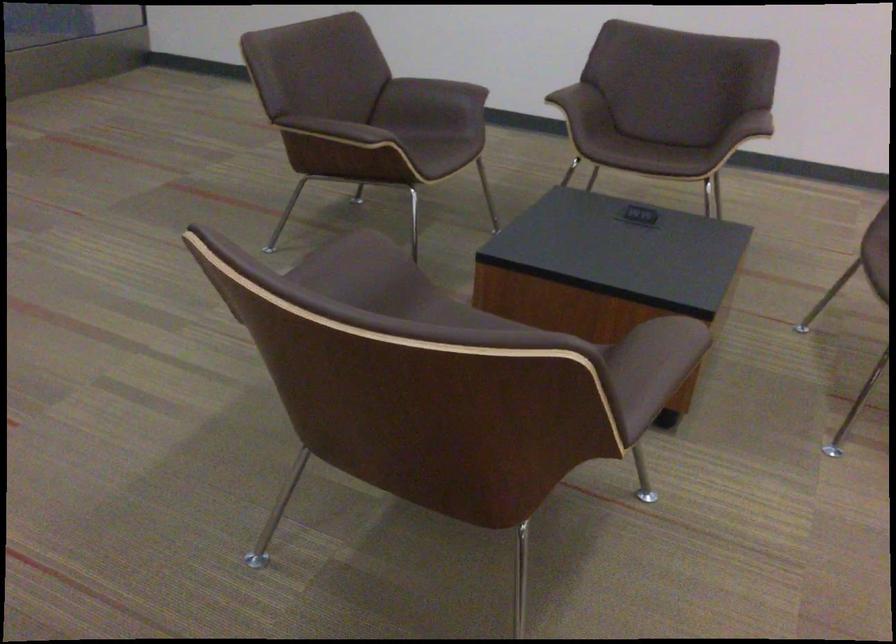
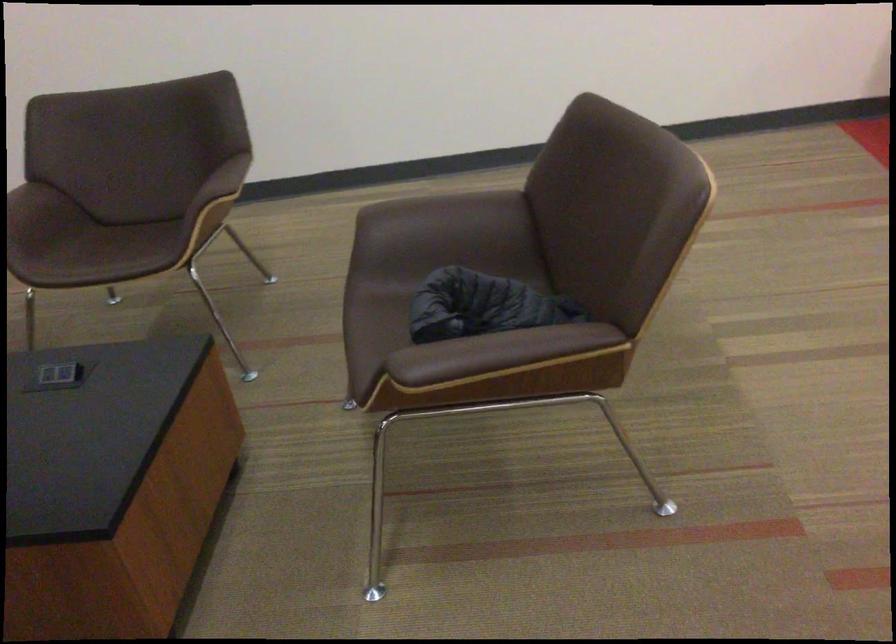
Which direction would the cameraman need to move to produce the second image?

The movement direction of the cameraman is right, forward.